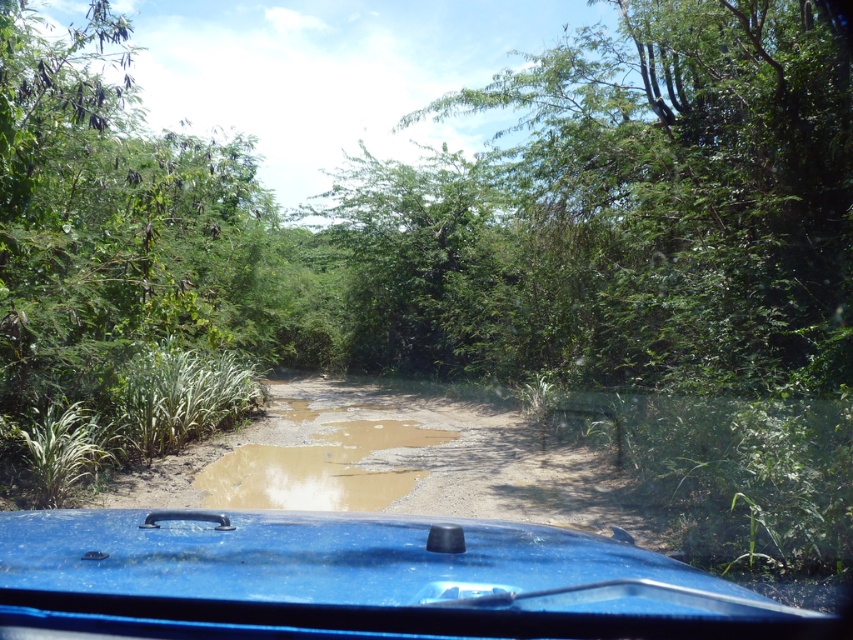
You are driving a car and want to avoid a muddy puddle ahead. The glossy blue car at center and brown muddy puddle at center are in your path. Can you safely drive through the space between them without hitting either?

The glossy blue car at center and brown muddy puddle at center are 6.28 meters apart from each other. Since the distance between them is sufficient to allow passage, you can safely drive through the space between them without hitting either.

You are driving a car and see two points marked on your GPS. The first point is at point (628, 586) and the second point is at point (231, 452). Which point is closer to your current position inside the vehicle?

Point (628, 586) is in front of point (231, 452), so the point closer to your current position inside the vehicle is point (628, 586).

You are a passenger sitting in the back seat of the glossy blue car at center. You want to reach a backpack placed on the roof rack, which is 7 feet away from you. Can you safely reach it from your current position?

The glossy blue car at center is 6.79 feet away from the viewer. Since the backpack is 7 feet away, it is slightly out of reach from the current position.